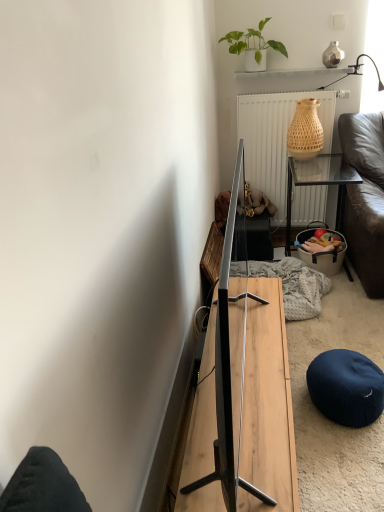
Question: Is wooden table at right, which is the second table in bottom-to-top order, surrounded by white textured radiator at upper center?

Choices:
 (A) no
 (B) yes

Answer: (A)

Question: Is white textured radiator at upper center shorter than wooden table at right, which is counted as the 2th table, starting from the left?

Choices:
 (A) no
 (B) yes

Answer: (A)

Question: From the image's perspective, is white textured radiator at upper center located above wooden table at right, the first table from the back?

Choices:
 (A) no
 (B) yes

Answer: (B)

Question: From a real-world perspective, is white textured radiator at upper center positioned under wooden table at right, the second table when ordered from front to back, based on gravity?

Choices:
 (A) yes
 (B) no

Answer: (B)

Question: Is white textured radiator at upper center to the right of wooden table at right, the first table from the back, from the viewer's perspective?

Choices:
 (A) yes
 (B) no

Answer: (B)

Question: Considering the positions of white textured radiator at upper center and dark blue fabric stool at lower right in the image, is white textured radiator at upper center wider or thinner than dark blue fabric stool at lower right?

Choices:
 (A) thin
 (B) wide

Answer: (A)

Question: Considering their positions, is white textured radiator at upper center located in front of or behind dark blue fabric stool at lower right?

Choices:
 (A) behind
 (B) front

Answer: (A)

Question: Do you think white textured radiator at upper center is within dark blue fabric stool at lower right, or outside of it?

Choices:
 (A) inside
 (B) outside

Answer: (B)

Question: Based on their sizes in the image, would you say white textured radiator at upper center is bigger or smaller than dark blue fabric stool at lower right?

Choices:
 (A) big
 (B) small

Answer: (A)

Question: In the image, is white textured radiator at upper center on the left side or the right side of green matte plant at upper center?

Choices:
 (A) right
 (B) left

Answer: (A)

Question: Looking at their shapes, would you say white textured radiator at upper center is wider or thinner than green matte plant at upper center?

Choices:
 (A) wide
 (B) thin

Answer: (B)

Question: Is point (274, 188) positioned closer to the camera than point (238, 31)?

Choices:
 (A) farther
 (B) closer

Answer: (A)

Question: Considering the positions of white textured radiator at upper center and green matte plant at upper center in the image, is white textured radiator at upper center bigger or smaller than green matte plant at upper center?

Choices:
 (A) big
 (B) small

Answer: (A)

Question: From the image's perspective, is wooden table at right, which is the first table from right to left, positioned above or below white textured radiator at upper center?

Choices:
 (A) above
 (B) below

Answer: (B)

Question: Considering the positions of wooden table at right, which is the second table in bottom-to-top order, and white textured radiator at upper center in the image, is wooden table at right, which is the second table in bottom-to-top order, taller or shorter than white textured radiator at upper center?

Choices:
 (A) tall
 (B) short

Answer: (B)